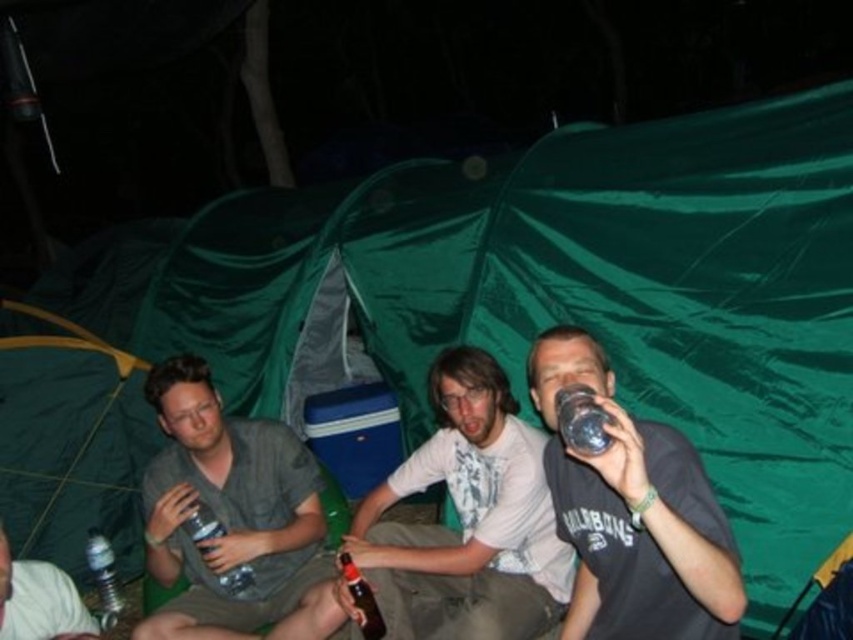
Question: Does matte gray t-shirt at center have a lesser width compared to clear plastic bottle at right?

Choices:
 (A) yes
 (B) no

Answer: (B)

Question: Which object appears closest to the camera in this image?

Choices:
 (A) brown glass bottle at center
 (B) brushed metal water bottle at lower left
 (C) clear plastic bottle at right
 (D) matte gray t-shirt at center

Answer: (C)

Question: Considering the relative positions of clear plastic bottle at right and clear plastic bottle at center in the image provided, where is clear plastic bottle at right located with respect to clear plastic bottle at center?

Choices:
 (A) above
 (B) below

Answer: (A)

Question: Is matte gray shirt at center further to the viewer compared to matte gray t-shirt at center?

Choices:
 (A) no
 (B) yes

Answer: (A)

Question: Which point appears farthest from the camera in this image?

Choices:
 (A) (589, 419)
 (B) (94, 563)

Answer: (B)

Question: Which of these objects is positioned farthest from the clear plastic bottle at lower left?

Choices:
 (A) brushed metal water bottle at lower left
 (B) clear plastic bottle at center

Answer: (B)